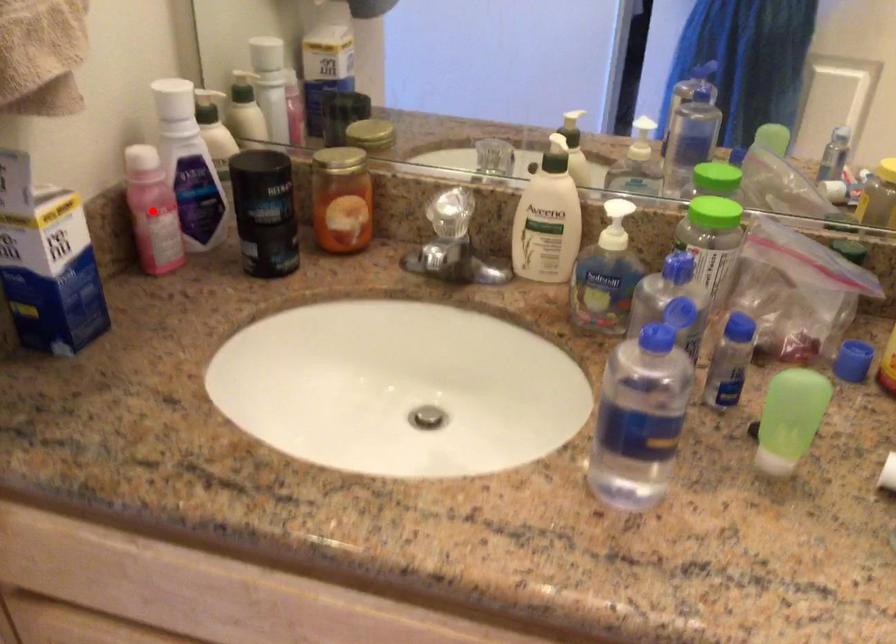
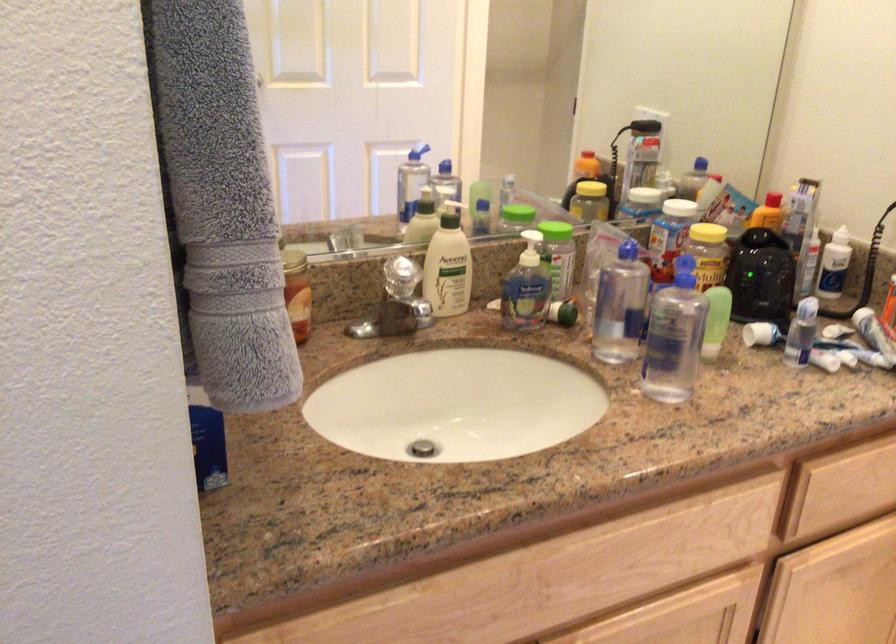
Question: I am providing you with two images of the same scene from different viewpoints. A red point is marked on the first image. At the location where the point appears in image 1, is it still visible in image 2?

Choices:
 (A) Yes
 (B) No

Answer: (B)